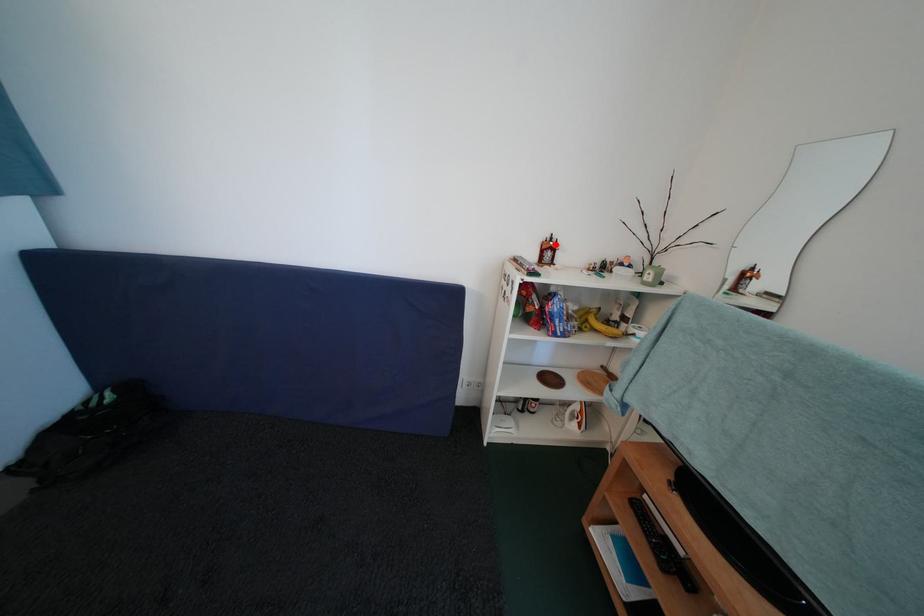
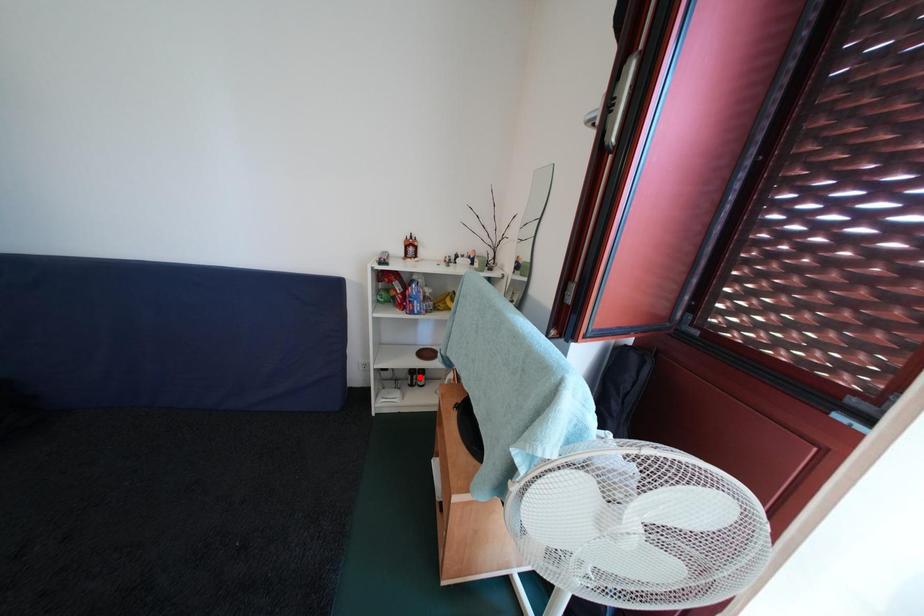
I am providing you with two images of the same scene from different viewpoints. A red point is marked on the first image and another point is marked on the second image. Is the marked point in image1 the same physical position as the marked point in image2?

No